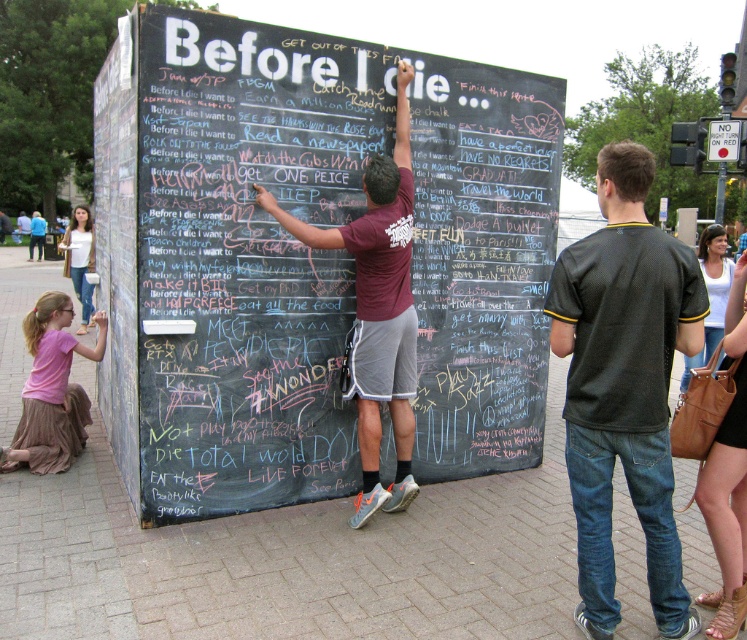
Which of these two, dark gray t-shirt at center or pink fabric skirt at lower left, stands taller?

Standing taller between the two is dark gray t-shirt at center.

Is dark gray t-shirt at center above pink fabric skirt at lower left?

Correct, dark gray t-shirt at center is located above pink fabric skirt at lower left.

Is point (650, 589) positioned behind point (13, 445)?

No.

Locate an element on the screen. dark gray t-shirt at center is located at coordinates (624, 385).

Which of these two, dark gray t-shirt at center or maroon t-shirt at center, stands shorter?

With less height is dark gray t-shirt at center.

Who is lower down, dark gray t-shirt at center or maroon t-shirt at center?

dark gray t-shirt at center is below.

Does point (568, 404) come farther from viewer compared to point (371, 336)?

No, it is in front of (371, 336).

Where is `dark gray t-shirt at center`? dark gray t-shirt at center is located at coordinates (624, 385).

Is black chalkboard at center smaller than brown leather purse at lower right?

Actually, black chalkboard at center might be larger than brown leather purse at lower right.

The width and height of the screenshot is (747, 640). Find the location of `black chalkboard at center`. black chalkboard at center is located at coordinates (329, 259).

In order to click on black chalkboard at center in this screenshot , I will do `click(329, 259)`.

Image resolution: width=747 pixels, height=640 pixels. Find the location of `black chalkboard at center`. black chalkboard at center is located at coordinates (329, 259).